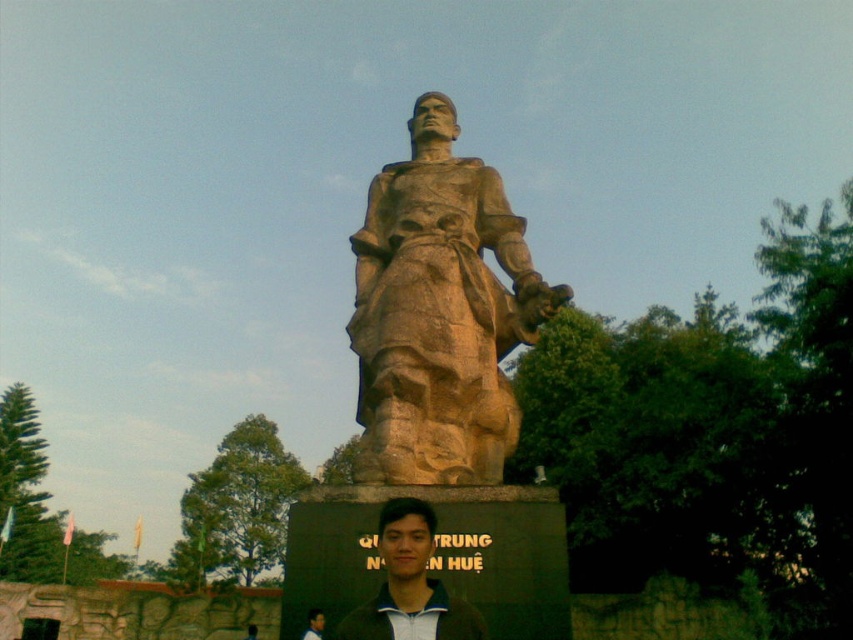
Question: Can you confirm if brown stone statue at center is positioned above dark green hair at center?

Choices:
 (A) no
 (B) yes

Answer: (B)

Question: Which point appears closest to the camera in this image?

Choices:
 (A) (315, 637)
 (B) (392, 625)
 (C) (488, 168)

Answer: (B)

Question: Which object is the farthest from the brown stone statue at center?

Choices:
 (A) dark green hair at center
 (B) dark brown leather jacket at lower center

Answer: (B)

Question: Is brown stone statue at center thinner than dark green hair at center?

Choices:
 (A) no
 (B) yes

Answer: (A)

Question: Is brown stone statue at center above dark green hair at center?

Choices:
 (A) no
 (B) yes

Answer: (B)

Question: Which of these objects is positioned farthest from the dark brown leather jacket at lower center?

Choices:
 (A) dark green hair at center
 (B) brown stone statue at center

Answer: (B)